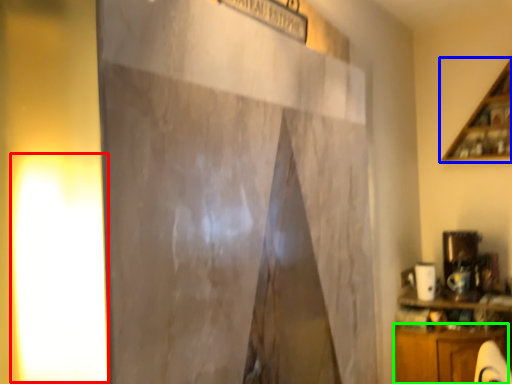
Question: Based on their relative distances, which object is nearer to light (highlighted by a red box)? Choose from shelf (highlighted by a blue box) and cabinetry (highlighted by a green box).

Choices:
 (A) shelf
 (B) cabinetry

Answer: (B)